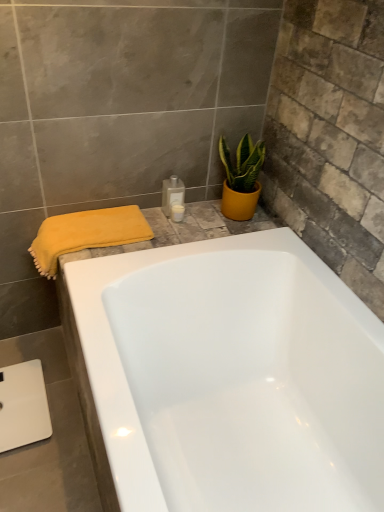
The width and height of the screenshot is (384, 512). What are the coordinates of `empty space that is ontop of yellow soft towel at left` in the screenshot? It's located at (88, 221).